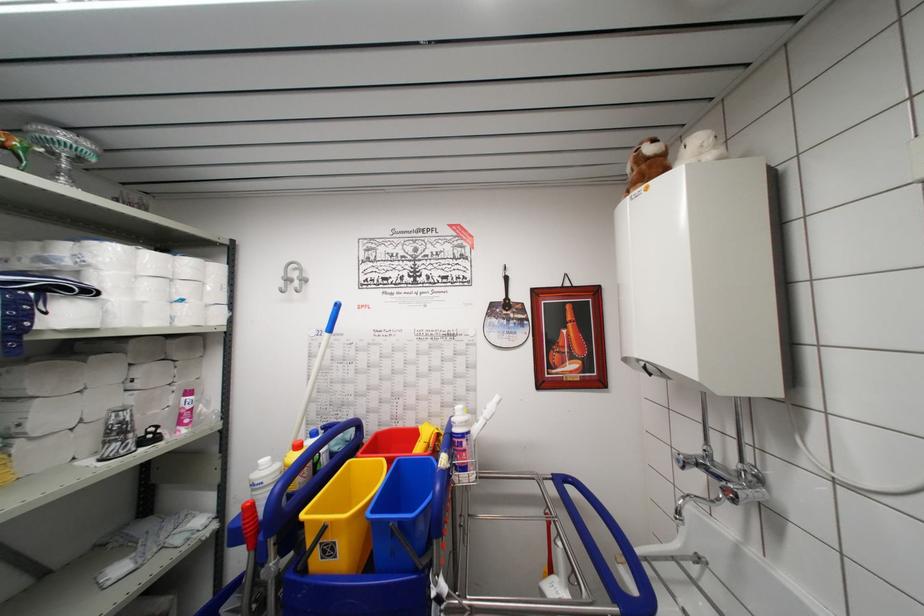
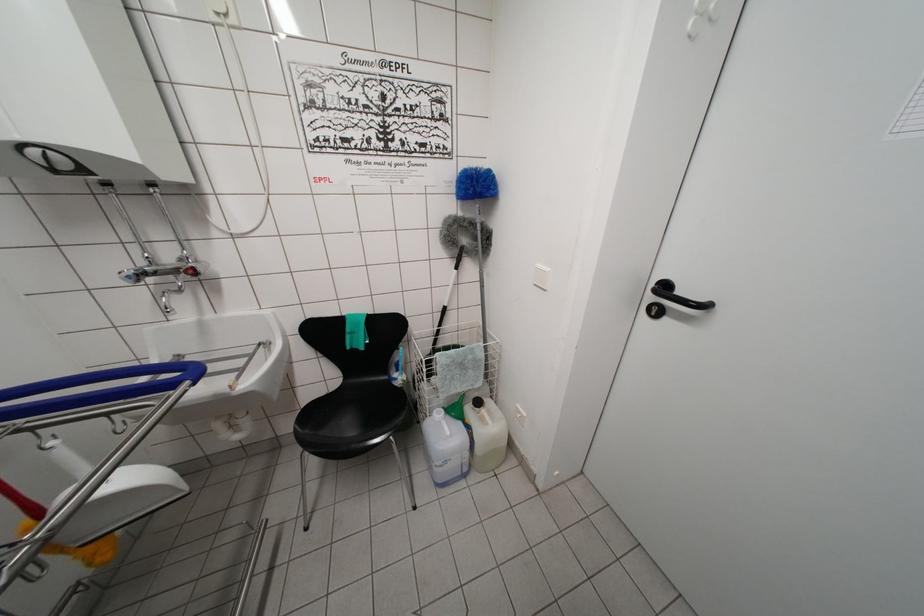
Find the pixel in the second image that matches point 735,490 in the first image.

(193, 270)